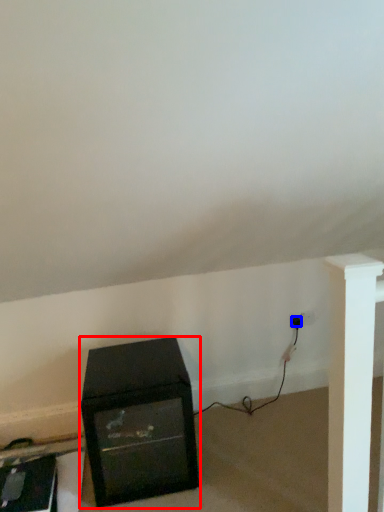
Question: Which object appears farthest to the camera in this image, furniture (highlighted by a red box) or plug (highlighted by a blue box)?

Choices:
 (A) furniture
 (B) plug

Answer: (B)